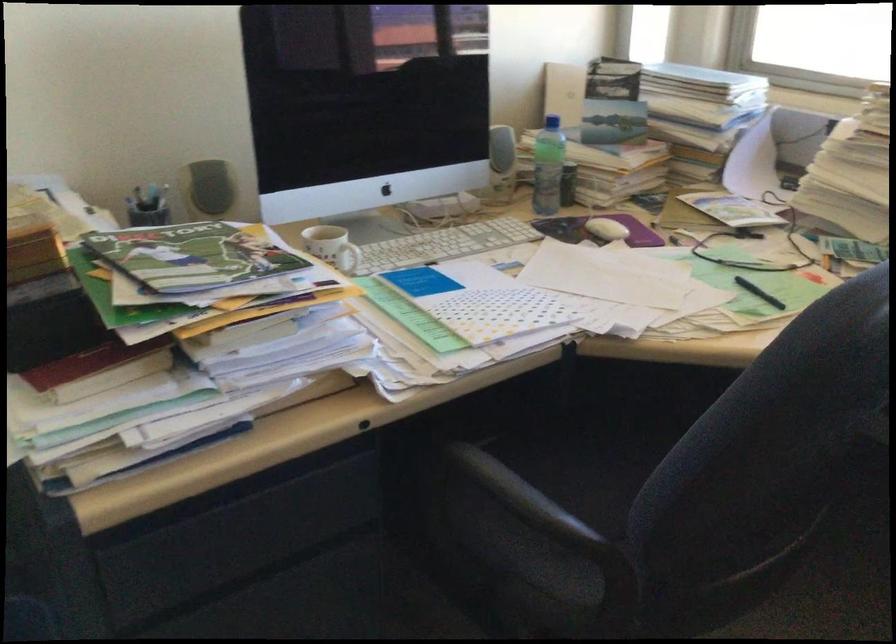
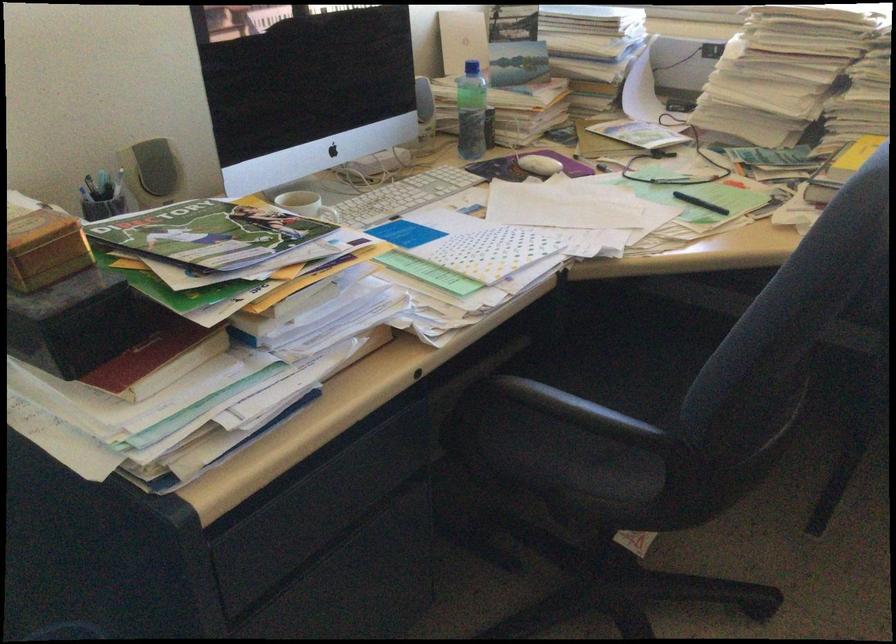
Question: I am providing you with two images of the same scene from different viewpoints. After the viewpoint changes to image2, which objects are now occluded?

Choices:
 (A) chair armrest
 (B) chair sitting surface
 (C) small brown box
 (D) none of these

Answer: (D)